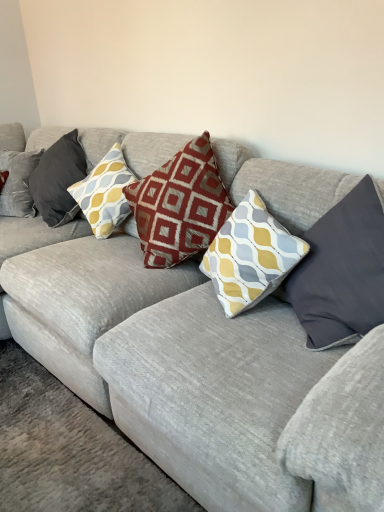
Question: Is dark gray fabric pillow at right, the 5th pillow in the left-to-right sequence, bigger or smaller than maroon fabric pillow at center, marked as the third pillow in a right-to-left arrangement?

Choices:
 (A) small
 (B) big

Answer: (A)

Question: In the image, is dark gray fabric pillow at right, the 1th pillow when ordered from right to left, on the left side or the right side of maroon fabric pillow at center, marked as the third pillow in a left-to-right arrangement?

Choices:
 (A) left
 (B) right

Answer: (B)

Question: Estimate the real-world distances between objects in this image. Which object is closer to the dark gray fabric pillow at right, the 1th pillow when ordered from right to left?

Choices:
 (A) maroon fabric pillow at center, marked as the third pillow in a left-to-right arrangement
 (B) red textured pillow at center, the fourth pillow from the right
 (C) yellow and gray patterned pillow at center, the fourth pillow viewed from the left
 (D) velvet cushion at left, the 5th pillow from the right

Answer: (C)

Question: Considering the real-world distances, which object is closest to the red textured pillow at center, the fourth pillow from the right?

Choices:
 (A) maroon fabric pillow at center, marked as the third pillow in a right-to-left arrangement
 (B) yellow and gray patterned pillow at center, the fourth pillow viewed from the left
 (C) velvet cushion at left, the 5th pillow from the right
 (D) dark gray fabric pillow at right, the 5th pillow in the left-to-right sequence

Answer: (C)